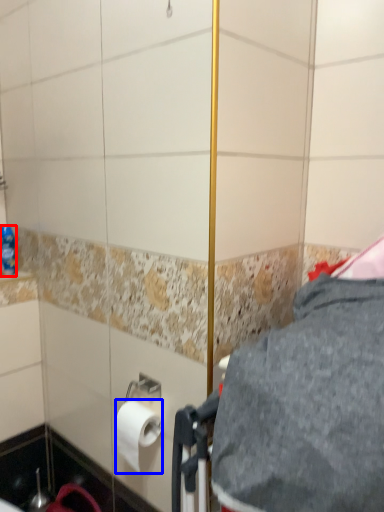
Question: Which object is closer to the camera taking this photo, bottle (highlighted by a red box) or toilet paper (highlighted by a blue box)?

Choices:
 (A) bottle
 (B) toilet paper

Answer: (B)